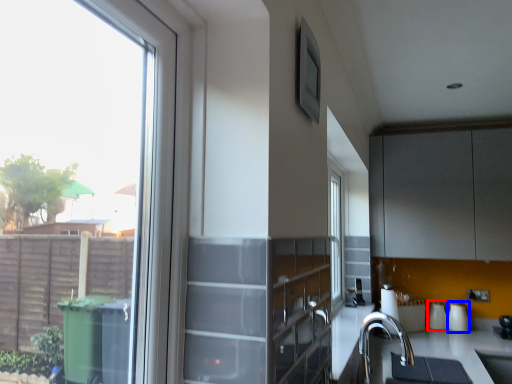
Question: Among these objects, which one is nearest to the camera, appliance (highlighted by a red box) or appliance (highlighted by a blue box)?

Choices:
 (A) appliance
 (B) appliance

Answer: (B)